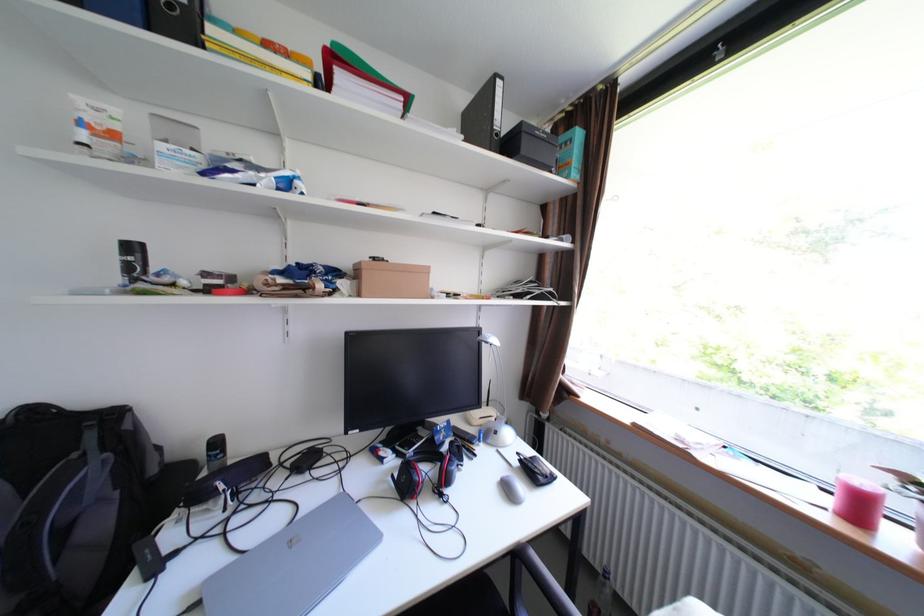
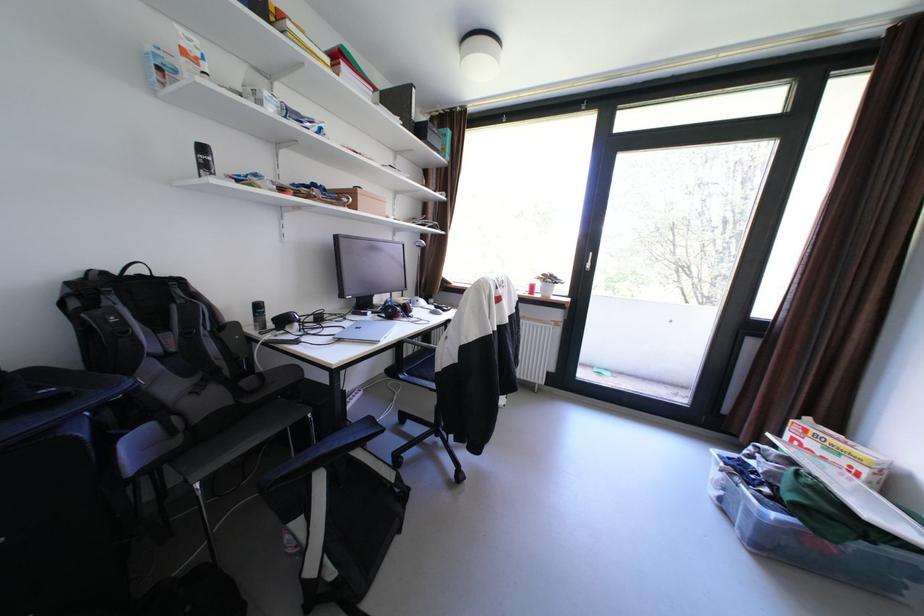
Question: I am providing you with two images of the same scene from different viewpoints. After the viewpoint changes to image2, which objects are now occluded?

Choices:
 (A) black computer mouse
 (B) silver door handle
 (C) magazine on rack
 (D) backpack top handle

Answer: (A)